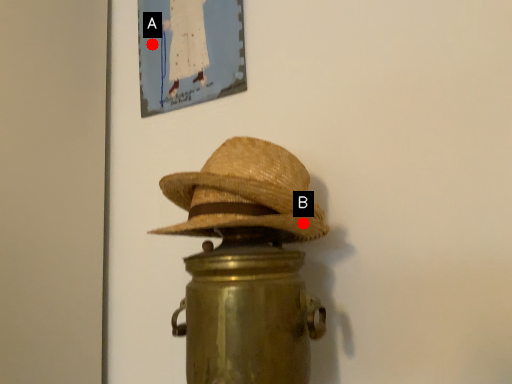
Question: Two points are circled on the image, labeled by A and B beside each circle. Which point is farther from the camera taking this photo?

Choices:
 (A) A is further
 (B) B is further

Answer: (A)